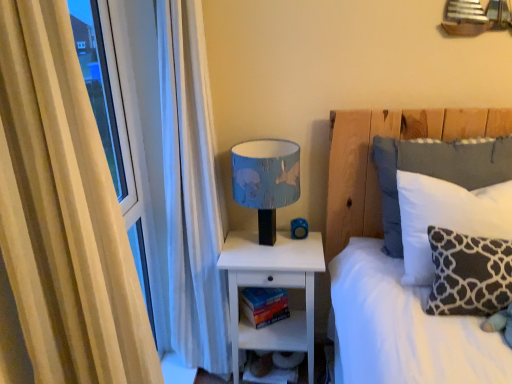
What do you see at coordinates (271, 287) in the screenshot?
I see `white matte nightstand at center` at bounding box center [271, 287].

What do you see at coordinates (266, 180) in the screenshot? I see `blue fabric lampshade at upper right` at bounding box center [266, 180].

What do you see at coordinates (264, 305) in the screenshot?
I see `hardcover book at lower center` at bounding box center [264, 305].

Locate an element on the screen. The height and width of the screenshot is (384, 512). dark gray fabric pillow at right, which is the 2th pillow from back to front is located at coordinates (446, 217).

The width and height of the screenshot is (512, 384). Find the location of `beige fabric curtain at left`. beige fabric curtain at left is located at coordinates (63, 213).

Which is more to the left, dark gray velvety pillow at right, arranged as the 3th pillow when viewed from the back, or hardcover book at lower center?

From the viewer's perspective, hardcover book at lower center appears more on the left side.

Between point (482, 246) and point (250, 291), which one is positioned behind?

Positioned behind is point (250, 291).

Is dark gray velvety pillow at right, arranged as the 3th pillow when viewed from the back, completely or partially outside of hardcover book at lower center?

That's correct, dark gray velvety pillow at right, arranged as the 3th pillow when viewed from the back, is outside of hardcover book at lower center.

From a real-world perspective, is dark gray velvety pillow at right, which is counted as the first pillow, starting from the front, above or below hardcover book at lower center?

Clearly, from a real-world perspective, dark gray velvety pillow at right, which is counted as the first pillow, starting from the front, is above hardcover book at lower center.

Which of these two, beige fabric curtain at left or dark gray fabric pillow at right, the 2th pillow positioned from the front, is bigger?

beige fabric curtain at left is bigger.

From the image's perspective, who appears lower, beige fabric curtain at left or dark gray fabric pillow at right, which is the 2th pillow from back to front?

From the image's view, beige fabric curtain at left is below.

Is beige fabric curtain at left taller or shorter than dark gray fabric pillow at right, the 2th pillow positioned from the front?

Considering their sizes, beige fabric curtain at left has more height than dark gray fabric pillow at right, the 2th pillow positioned from the front.

Is white soft pillow at upper right, which appears as the third pillow when viewed from the front, directly adjacent to beige fabric curtain at left?

No, white soft pillow at upper right, which appears as the third pillow when viewed from the front, is not next to beige fabric curtain at left.

Can you confirm if white soft pillow at upper right, which is the first pillow in back-to-front order, is taller than beige fabric curtain at left?

In fact, white soft pillow at upper right, which is the first pillow in back-to-front order, may be shorter than beige fabric curtain at left.

From a real-world perspective, does white soft pillow at upper right, which is the first pillow in back-to-front order, stand above beige fabric curtain at left?

No.

Can you confirm if white soft pillow at upper right, which appears as the third pillow when viewed from the front, is smaller than beige fabric curtain at left?

Yes.

Is dark gray velvety pillow at right, arranged as the 3th pillow when viewed from the back, situated inside dark gray fabric pillow at right, the 2th pillow positioned from the front, or outside?

dark gray velvety pillow at right, arranged as the 3th pillow when viewed from the back, is outside dark gray fabric pillow at right, the 2th pillow positioned from the front.

Which is more to the right, dark gray velvety pillow at right, arranged as the 3th pillow when viewed from the back, or dark gray fabric pillow at right, the 2th pillow positioned from the front?

dark gray fabric pillow at right, the 2th pillow positioned from the front.

Considering their positions, is dark gray velvety pillow at right, arranged as the 3th pillow when viewed from the back, located in front of or behind dark gray fabric pillow at right, the 2th pillow positioned from the front?

dark gray velvety pillow at right, arranged as the 3th pillow when viewed from the back, is in front of dark gray fabric pillow at right, the 2th pillow positioned from the front.

Between point (436, 251) and point (469, 205), which one is positioned in front?

Positioned in front is point (436, 251).

Is dark gray fabric pillow at right, the 2th pillow positioned from the front, wider or thinner than white soft pillow at upper right, which is the first pillow in back-to-front order?

A: In the image, dark gray fabric pillow at right, the 2th pillow positioned from the front, appears to be wider than white soft pillow at upper right, which is the first pillow in back-to-front order.

Is dark gray fabric pillow at right, which is the 2th pillow from back to front, positioned far away from white soft pillow at upper right, which is the first pillow in back-to-front order?

No, dark gray fabric pillow at right, which is the 2th pillow from back to front, is in close proximity to white soft pillow at upper right, which is the first pillow in back-to-front order.

Looking at this image, from the image's perspective, is dark gray fabric pillow at right, which is the 2th pillow from back to front, above or below white soft pillow at upper right, which appears as the third pillow when viewed from the front?

Based on their image positions, dark gray fabric pillow at right, which is the 2th pillow from back to front, is located beneath white soft pillow at upper right, which appears as the third pillow when viewed from the front.

Which object is positioned more to the left, white soft pillow at upper right, which is the first pillow in back-to-front order, or blue fabric lampshade at upper right?

blue fabric lampshade at upper right.

Image resolution: width=512 pixels, height=384 pixels. I want to click on table lamp behind the white soft pillow at upper right, which appears as the third pillow when viewed from the front, so click(266, 180).

From a real-world perspective, which is physically below, white soft pillow at upper right, which is the first pillow in back-to-front order, or blue fabric lampshade at upper right?

blue fabric lampshade at upper right, from a real-world perspective.

Is white matte nightstand at center taller than white soft pillow at upper right, which is the first pillow in back-to-front order?

Indeed, white matte nightstand at center has a greater height compared to white soft pillow at upper right, which is the first pillow in back-to-front order.

Between white matte nightstand at center and white soft pillow at upper right, which appears as the third pillow when viewed from the front, which one has smaller width?

With smaller width is white soft pillow at upper right, which appears as the third pillow when viewed from the front.

Does point (297, 334) appear closer or farther from the camera than point (475, 148)?

Point (297, 334) is positioned farther from the camera compared to point (475, 148).

At what (x,y) coordinates should I click in order to perform the action: click on book located behind the dark gray velvety pillow at right, arranged as the 3th pillow when viewed from the back. Please return your answer as a coordinate pair (x, y). The width and height of the screenshot is (512, 384). Looking at the image, I should click on (264, 305).

Image resolution: width=512 pixels, height=384 pixels. In order to click on the 2nd pillow counting from the right of the beige fabric curtain at left in this screenshot , I will do `click(446, 217)`.

Which object lies further to the anchor point beige fabric curtain at left, white soft pillow at upper right, which is the first pillow in back-to-front order, or dark gray velvety pillow at right, which is counted as the first pillow, starting from the front?

white soft pillow at upper right, which is the first pillow in back-to-front order.

When comparing their distances from beige fabric curtain at left, does hardcover book at lower center or dark gray fabric pillow at right, the 2th pillow positioned from the front, seem closer?

dark gray fabric pillow at right, the 2th pillow positioned from the front, is closer to beige fabric curtain at left.

Considering their positions, is hardcover book at lower center positioned closer to blue fabric lampshade at upper right than beige fabric curtain at left?

Based on the image, hardcover book at lower center appears to be nearer to blue fabric lampshade at upper right.

From the image, which object appears to be nearer to dark gray velvety pillow at right, which is counted as the first pillow, starting from the front, dark gray fabric pillow at right, the 2th pillow positioned from the front, or white soft pillow at upper right, which appears as the third pillow when viewed from the front?

dark gray fabric pillow at right, the 2th pillow positioned from the front, lies closer to dark gray velvety pillow at right, which is counted as the first pillow, starting from the front, than the other object.

From the image, which object appears to be farther from dark gray fabric pillow at right, the 2th pillow positioned from the front, white matte nightstand at center or white soft pillow at upper right, which appears as the third pillow when viewed from the front?

Based on the image, white matte nightstand at center appears to be further to dark gray fabric pillow at right, the 2th pillow positioned from the front.

Estimate the real-world distances between objects in this image. Which object is further from dark gray fabric pillow at right, which is the 2th pillow from back to front, blue fabric lampshade at upper right or white soft pillow at upper right, which appears as the third pillow when viewed from the front?

Among the two, blue fabric lampshade at upper right is located further to dark gray fabric pillow at right, which is the 2th pillow from back to front.

Considering their positions, is dark gray velvety pillow at right, which is counted as the first pillow, starting from the front, positioned further to white soft pillow at upper right, which appears as the third pillow when viewed from the front, than dark gray fabric pillow at right, the 2th pillow positioned from the front?

Based on the image, dark gray velvety pillow at right, which is counted as the first pillow, starting from the front, appears to be further to white soft pillow at upper right, which appears as the third pillow when viewed from the front.

Based on their spatial positions, is dark gray velvety pillow at right, which is counted as the first pillow, starting from the front, or blue fabric lampshade at upper right closer to white matte nightstand at center?

blue fabric lampshade at upper right.

The width and height of the screenshot is (512, 384). What are the coordinates of `nightstand located between blue fabric lampshade at upper right and dark gray fabric pillow at right, which is the 2th pillow from back to front, in the left-right direction` in the screenshot? It's located at (271, 287).

Locate an element on the screen. This screenshot has width=512, height=384. book between blue fabric lampshade at upper right and white matte nightstand at center from top to bottom is located at coordinates pyautogui.click(x=264, y=305).

Image resolution: width=512 pixels, height=384 pixels. I want to click on nightstand between hardcover book at lower center and white soft pillow at upper right, which appears as the third pillow when viewed from the front, so click(x=271, y=287).

The image size is (512, 384). What are the coordinates of `table lamp located between beige fabric curtain at left and white matte nightstand at center in the depth direction` in the screenshot? It's located at (266, 180).